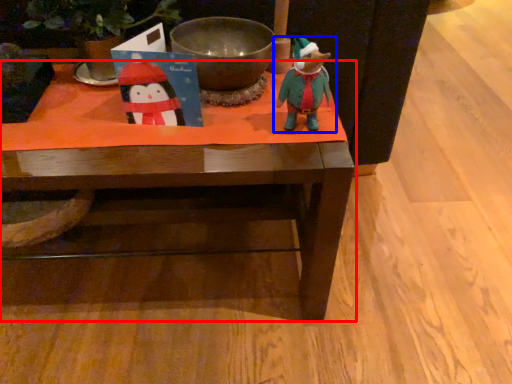
Question: Which object appears farthest to the camera in this image, table (highlighted by a red box) or toy (highlighted by a blue box)?

Choices:
 (A) table
 (B) toy

Answer: (A)